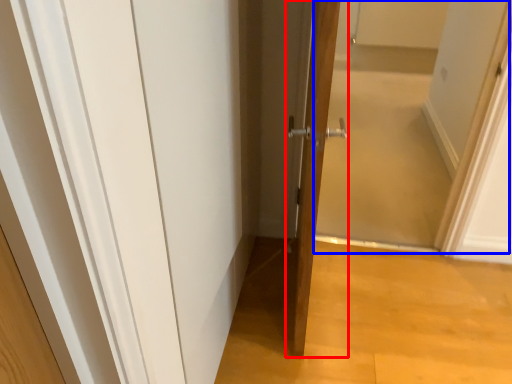
Question: Which object appears farthest to the camera in this image, door (highlighted by a red box) or screen door (highlighted by a blue box)?

Choices:
 (A) door
 (B) screen door

Answer: (B)